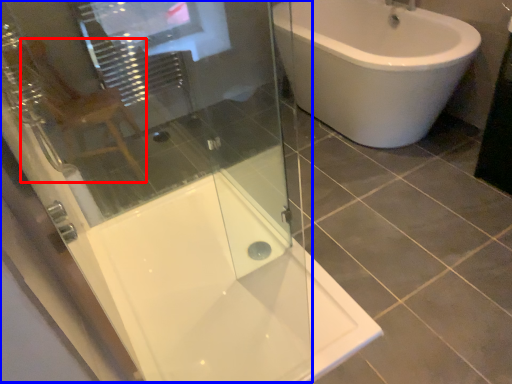
Question: Which of the following is the farthest to the observer, gray (highlighted by a red box) or screen door (highlighted by a blue box)?

Choices:
 (A) gray
 (B) screen door

Answer: (A)